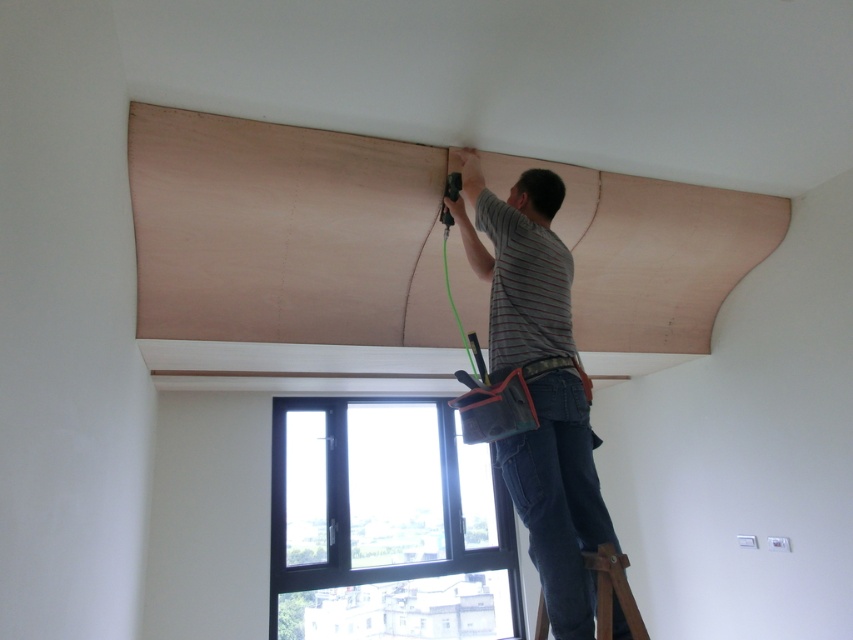
You are a contractor working on a ceiling installation. You need to place a new panel at the point marked as point (285, 248). According to the scene description, what material should you use for the new panel?

The point (285, 248) corresponds to natural wood plywood at upper center, so you should use natural wood plywood for the new panel.

You are a contractor assessing the installation of the natural wood plywood at upper center and the clear glass window at center. From the observer standing below, which object is positioned higher?

The natural wood plywood at upper center is positioned higher than the clear glass window at center.

You are an interior designer assessing the room. You need to ensure that the natural wood plywood at upper center and the clear glass window at center are proportionate. Based on their sizes, which object is wider?

The natural wood plywood at upper center is wider than the clear glass window at center.